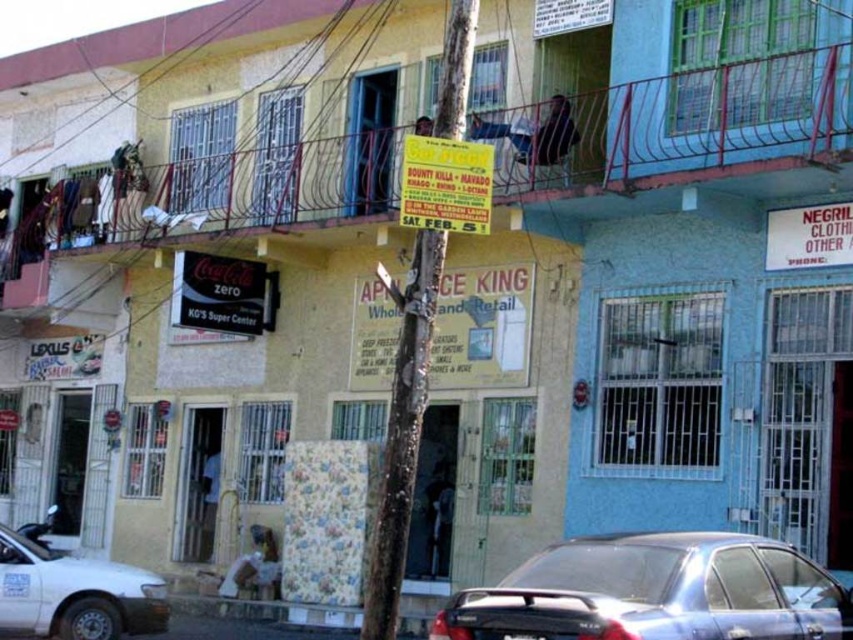
You are a delivery driver who needs to park your vehicle in the street scene shown. Your van is 5 meters long. The space between the metallic blue sedan at lower center and the white matte car at lower left is available. Can your van fit in that space?

The metallic blue sedan at lower center is bigger than the white matte car at lower left, but the exact distance between them isn not provided. Without knowing the space between the two cars, it is impossible to determine if the van will fit.

You are standing on the street looking at the building. There are two points marked on the building wall. The first point is at position point (824, 605) and the second is at point (22, 570). Which point is closer to you?

Point (824, 605) is in front of point (22, 570), so the first point is closer to you.